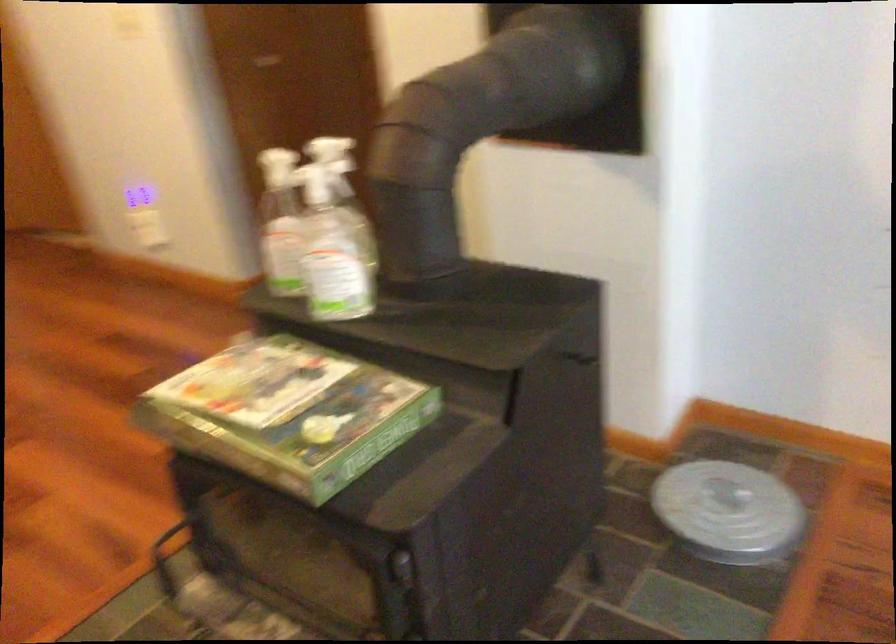
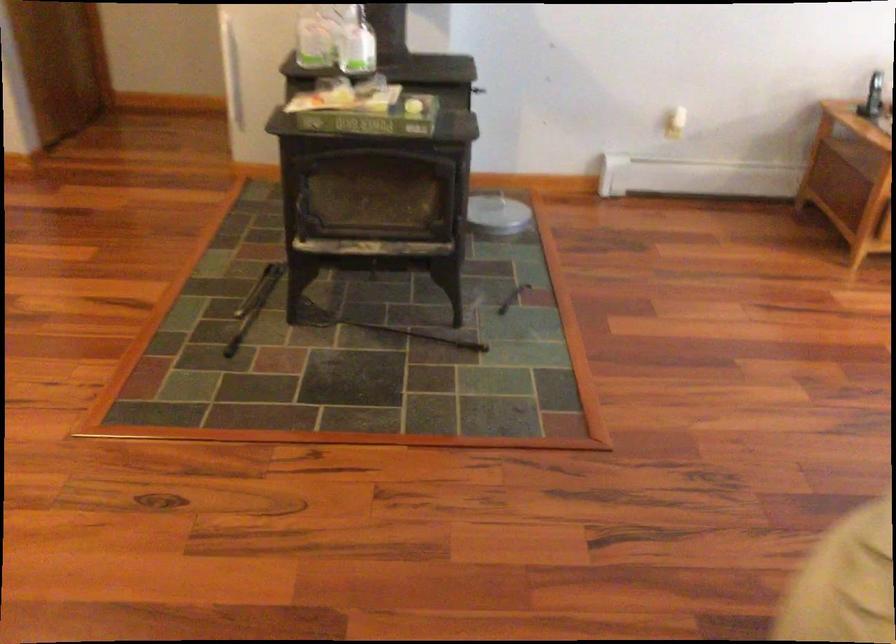
Find the pixel in the second image that matches [293,254] in the first image.

(314, 41)